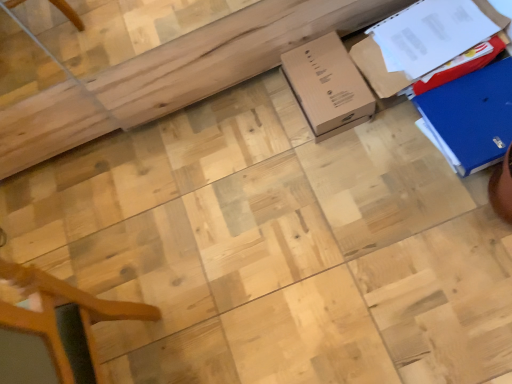
Locate an element on the screen. empty space that is ontop of brown cardboard box at center, which appears as the 3th cardboard box when viewed from the right (from a real-world perspective) is located at coordinates (318, 85).